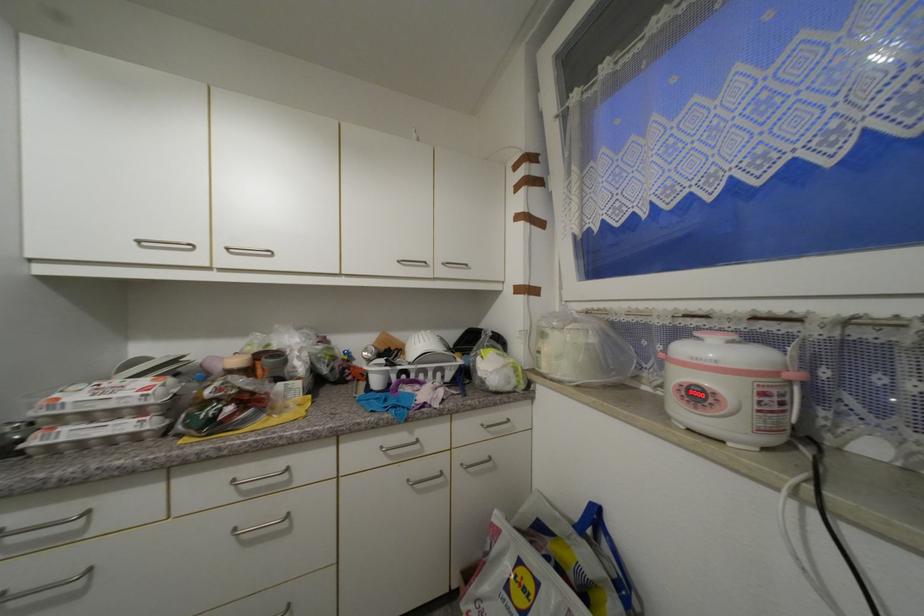
The image size is (924, 616). Identify the location of pink cooker handle. (794, 373).